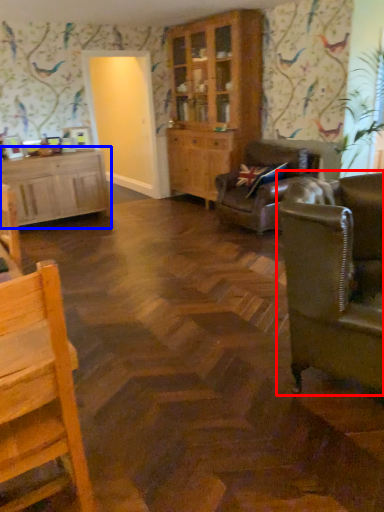
Question: Which object is closer to the camera taking this photo, studio couch (highlighted by a red box) or cabinetry (highlighted by a blue box)?

Choices:
 (A) studio couch
 (B) cabinetry

Answer: (A)